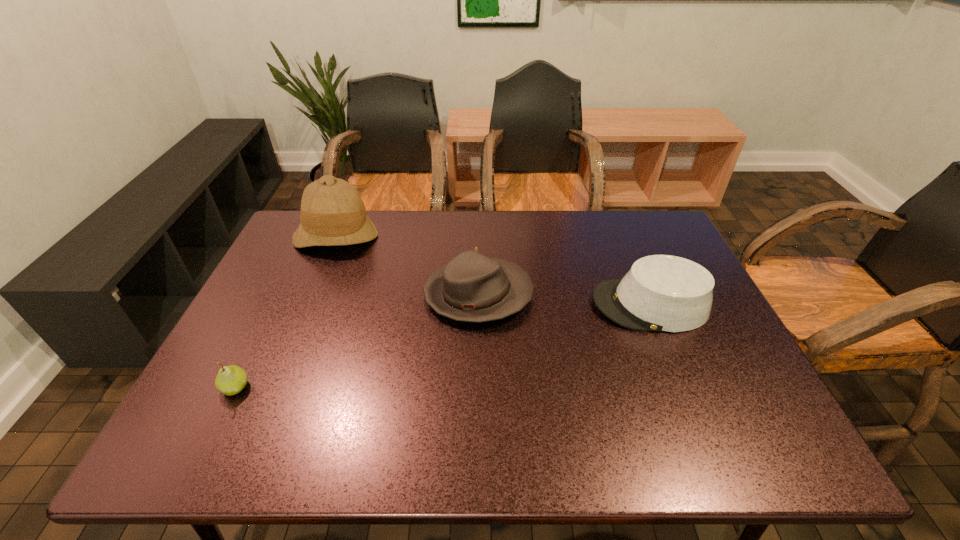
Identify the location of vacant space in between the pear and the third object from left to right. (357, 341).

Locate an element on the screen. This screenshot has width=960, height=540. unoccupied position between the rightmost hat and the pear is located at coordinates pyautogui.click(x=443, y=346).

You are a GUI agent. You are given a task and a screenshot of the screen. Output one action in this format:
    pyautogui.click(x=<x>, y=<y>)
    Task: Click on the vacant area that lies between the nearest object and the rightmost object
    
    Given the screenshot: What is the action you would take?
    pyautogui.click(x=443, y=346)

Locate an element on the screen. Image resolution: width=960 pixels, height=540 pixels. free space between the second hat from left to right and the farthest hat is located at coordinates (407, 266).

The width and height of the screenshot is (960, 540). What are the coordinates of `free space that is in between the second hat from right to left and the farthest hat` in the screenshot? It's located at (407, 266).

Where is `vacant area between the second hat from left to right and the pear`? This screenshot has height=540, width=960. vacant area between the second hat from left to right and the pear is located at coordinates (357, 341).

Identify the location of free space between the nearest object and the tallest hat. (286, 312).

The height and width of the screenshot is (540, 960). I want to click on unoccupied area between the nearest object and the farthest hat, so click(286, 312).

Identify which object is located as the third nearest to the tallest object. Please provide its 2D coordinates. Your answer should be formatted as a tuple, i.e. [(x, y)], where the tuple contains the x and y coordinates of a point satisfying the conditions above.

[(665, 293)]

Image resolution: width=960 pixels, height=540 pixels. What are the coordinates of `object that stands as the third closest to the nearest object` in the screenshot? It's located at (665, 293).